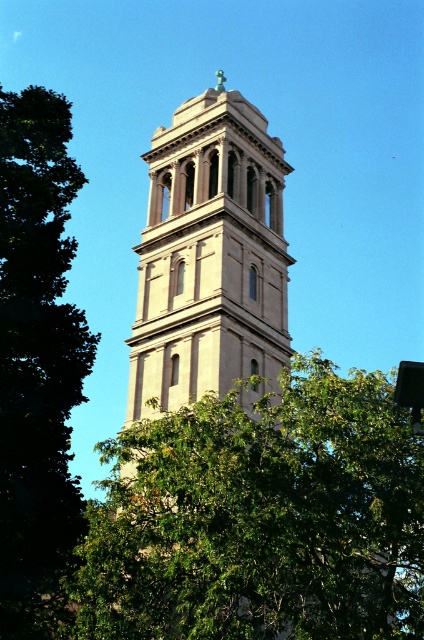
Question: Which is nearer to the beige stone tower at center?

Choices:
 (A) green leafy tree at center
 (B) green leafy tree at left

Answer: (A)

Question: Can you confirm if green leafy tree at center is positioned below beige stone tower at center?

Choices:
 (A) yes
 (B) no

Answer: (A)

Question: Is beige stone tower at center further to camera compared to green leafy tree at left?

Choices:
 (A) no
 (B) yes

Answer: (B)

Question: Considering the real-world distances, which object is closest to the green leafy tree at center?

Choices:
 (A) green leafy tree at left
 (B) beige stone tower at center

Answer: (A)

Question: Which object is positioned closest to the beige stone tower at center?

Choices:
 (A) green leafy tree at center
 (B) green leafy tree at left

Answer: (A)

Question: Considering the relative positions of green leafy tree at center and green leafy tree at left in the image provided, where is green leafy tree at center located with respect to green leafy tree at left?

Choices:
 (A) above
 (B) below

Answer: (B)